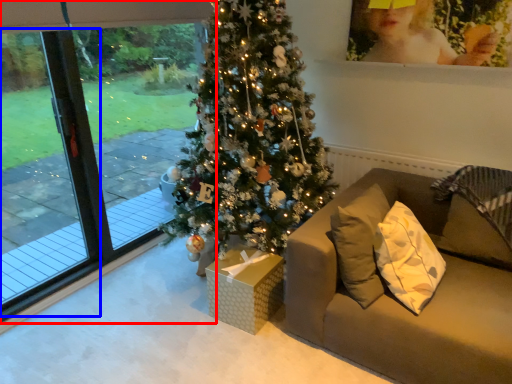
Question: Which of the following is the farthest to the observer, window (highlighted by a red box) or screen door (highlighted by a blue box)?

Choices:
 (A) window
 (B) screen door

Answer: (B)